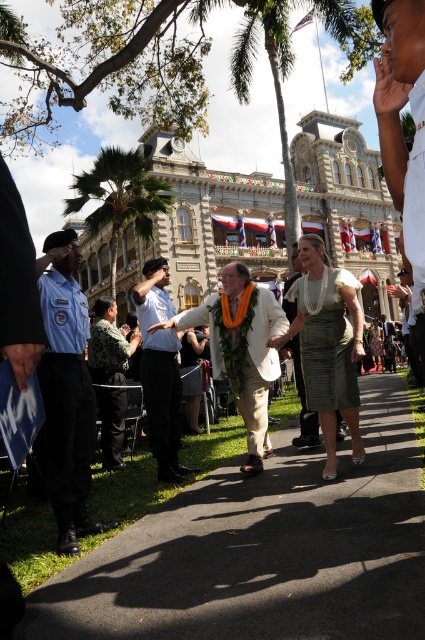
Does black asphalt pavement at center appear over satin gold dress at center?

Actually, black asphalt pavement at center is below satin gold dress at center.

Does point (218, 595) lie in front of point (323, 397)?

Yes, point (218, 595) is in front of point (323, 397).

Where is `black asphalt pavement at center`? The image size is (425, 640). black asphalt pavement at center is located at coordinates (263, 550).

Does white uniform at upper center have a smaller size compared to matte black dress at center?

Incorrect, white uniform at upper center is not smaller in size than matte black dress at center.

Does point (424, 198) come closer to viewer compared to point (300, 401)?

Yes.

At what (x,y) coordinates should I click in order to perform the action: click on white uniform at upper center. Please return your answer as a coordinate pair (x, y). The image size is (425, 640). Looking at the image, I should click on (416, 216).

Does point (68, 435) come behind point (345, 355)?

No, (68, 435) is closer to viewer.

Is light blue uniform at left to the right of satin gold dress at center from the viewer's perspective?

In fact, light blue uniform at left is to the left of satin gold dress at center.

Between point (73, 552) and point (325, 301), which one is positioned behind?

Positioned behind is point (325, 301).

Locate an element on the screen. This screenshot has width=425, height=640. light blue uniform at left is located at coordinates (67, 392).